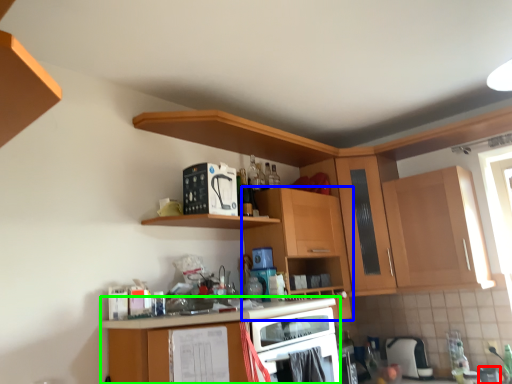
Question: Estimate the real-world distances between objects in this image. Which object is closer to appliance (highlighted by a red box), cabinetry (highlighted by a blue box) or cabinetry (highlighted by a green box)?

Choices:
 (A) cabinetry
 (B) cabinetry

Answer: (A)